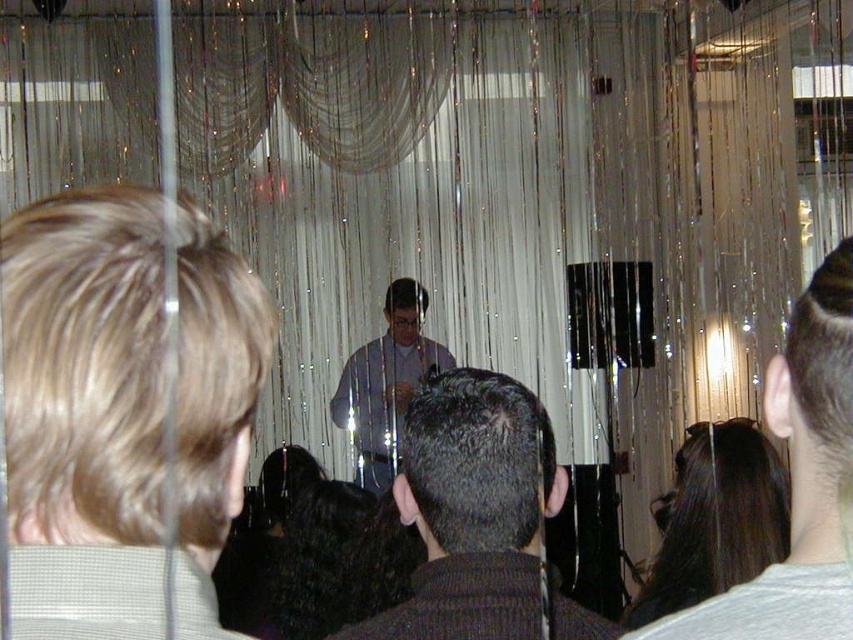
Question: In this image, where is dark gray knit sweater at center located relative to dark brown hair at center?

Choices:
 (A) left
 (B) right

Answer: (A)

Question: Is the position of dark gray knit sweater at center less distant than that of matte gray shirt at center?

Choices:
 (A) yes
 (B) no

Answer: (A)

Question: Among these objects, which one is farthest from the camera?

Choices:
 (A) dark gray knit sweater at center
 (B) dark brown hair at center
 (C) matte gray shirt at center

Answer: (C)

Question: Among these points, which one is farthest from the camera?

Choices:
 (A) (378, 394)
 (B) (543, 442)
 (C) (842, 298)

Answer: (A)

Question: Among these objects, which one is nearest to the camera?

Choices:
 (A) dark gray knit sweater at center
 (B) matte gray shirt at center
 (C) dark brown hair at center

Answer: (C)

Question: Does dark brown hair at center have a greater width compared to matte gray shirt at center?

Choices:
 (A) no
 (B) yes

Answer: (A)